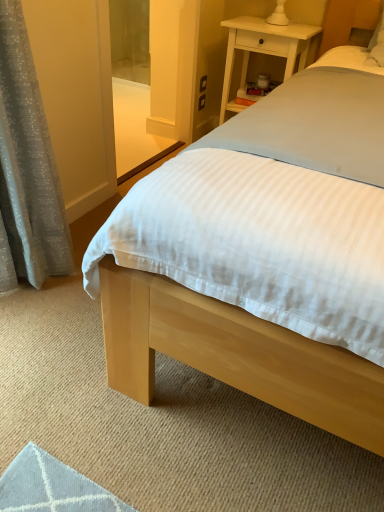
Question: Is gray textured curtain at left further to camera compared to light wood bed at center?

Choices:
 (A) yes
 (B) no

Answer: (A)

Question: From the image's perspective, does gray textured curtain at left appear higher than light wood bed at center?

Choices:
 (A) no
 (B) yes

Answer: (A)

Question: Is gray textured curtain at left taller than light wood bed at center?

Choices:
 (A) no
 (B) yes

Answer: (A)

Question: Can you confirm if gray textured curtain at left is smaller than light wood bed at center?

Choices:
 (A) yes
 (B) no

Answer: (A)

Question: From the image's perspective, is gray textured curtain at left under light wood bed at center?

Choices:
 (A) yes
 (B) no

Answer: (A)

Question: From a real-world perspective, is gray textured curtain at left positioned above or below white wood nightstand at upper right?

Choices:
 (A) below
 (B) above

Answer: (B)

Question: Is gray textured curtain at left wider or thinner than white wood nightstand at upper right?

Choices:
 (A) wide
 (B) thin

Answer: (B)

Question: Considering their positions, is gray textured curtain at left located in front of or behind white wood nightstand at upper right?

Choices:
 (A) front
 (B) behind

Answer: (A)

Question: Does point (41, 226) appear closer or farther from the camera than point (283, 32)?

Choices:
 (A) farther
 (B) closer

Answer: (B)

Question: Looking at their shapes, would you say white wood nightstand at upper right is wider or thinner than light wood bed at center?

Choices:
 (A) thin
 (B) wide

Answer: (A)

Question: Does point (248, 36) appear closer or farther from the camera than point (299, 32)?

Choices:
 (A) farther
 (B) closer

Answer: (B)

Question: Is white wood nightstand at upper right in front of or behind light wood bed at center in the image?

Choices:
 (A) behind
 (B) front

Answer: (A)

Question: Is white wood nightstand at upper right to the left or to the right of light wood bed at center in the image?

Choices:
 (A) right
 (B) left

Answer: (B)

Question: In terms of width, does gray textured curtain at left look wider or thinner when compared to light wood bed at center?

Choices:
 (A) wide
 (B) thin

Answer: (B)

Question: In the image, is gray textured curtain at left positioned in front of or behind light wood bed at center?

Choices:
 (A) front
 (B) behind

Answer: (B)